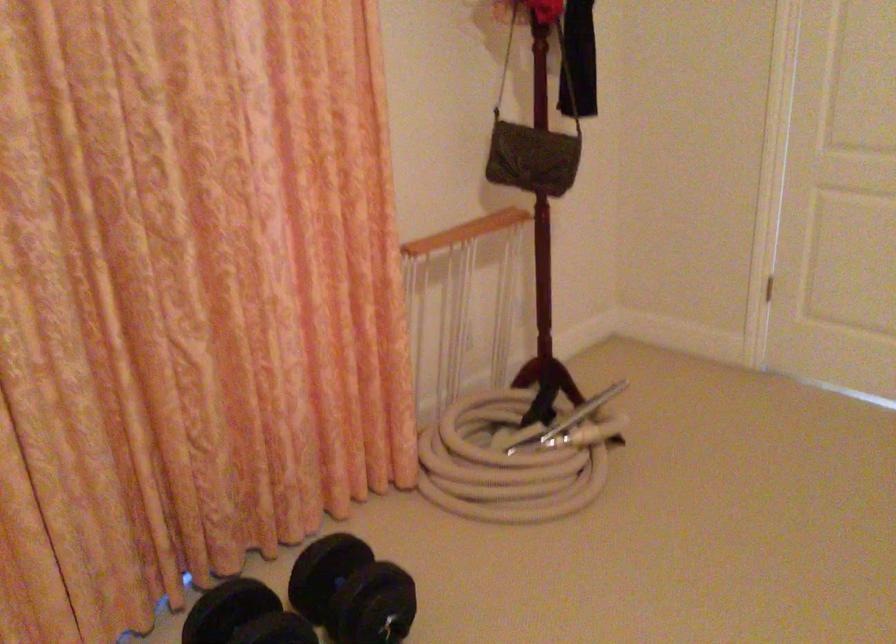
At what (x,y) coordinates should I click in order to perform the action: click on green shoulder bag. Please return your answer as a coordinate pair (x, y). Looking at the image, I should click on (531, 158).